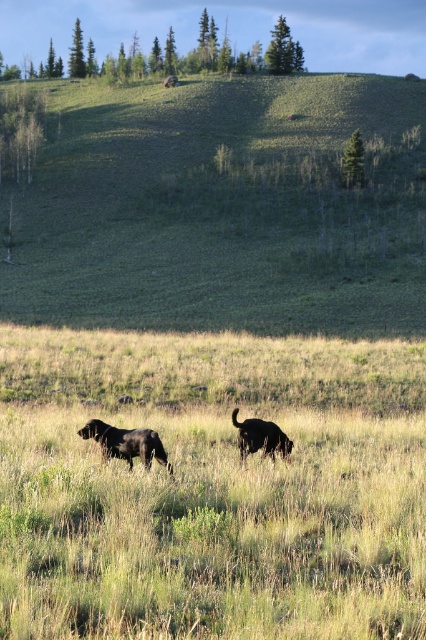
Question: Which of the following is the closest to the observer?

Choices:
 (A) (233, 413)
 (B) (141, 253)

Answer: (A)

Question: Among these objects, which one is farthest from the camera?

Choices:
 (A) green grassy hillside at center
 (B) black matte dog at center
 (C) shiny black dog at lower left

Answer: (A)

Question: Does shiny black dog at lower left come in front of black matte dog at center?

Choices:
 (A) no
 (B) yes

Answer: (B)

Question: Which point is farther to the camera?

Choices:
 (A) [x=245, y=195]
 (B) [x=97, y=426]

Answer: (A)

Question: Is shiny black dog at lower left positioned in front of black matte dog at center?

Choices:
 (A) yes
 (B) no

Answer: (A)

Question: Is green grassy hillside at center thinner than shiny black dog at lower left?

Choices:
 (A) yes
 (B) no

Answer: (B)